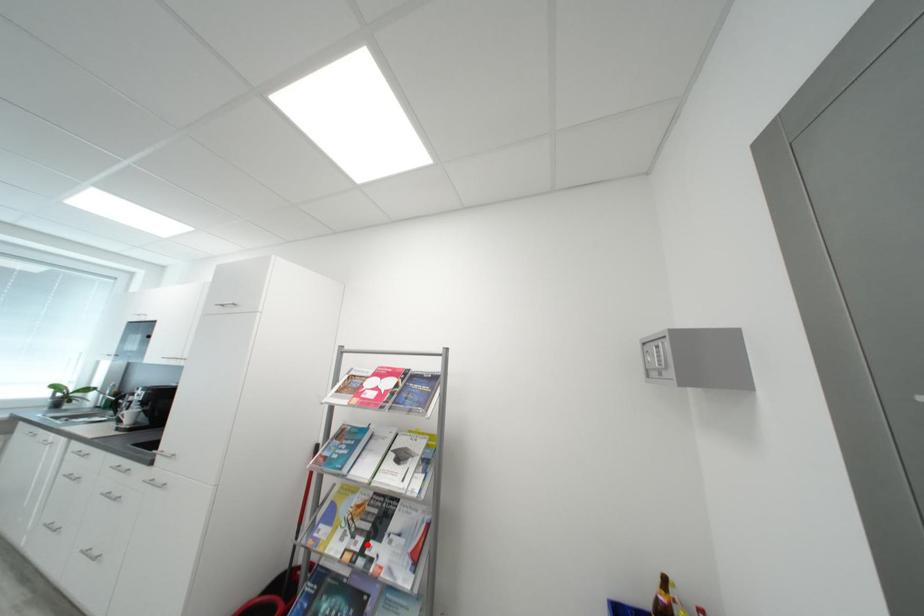
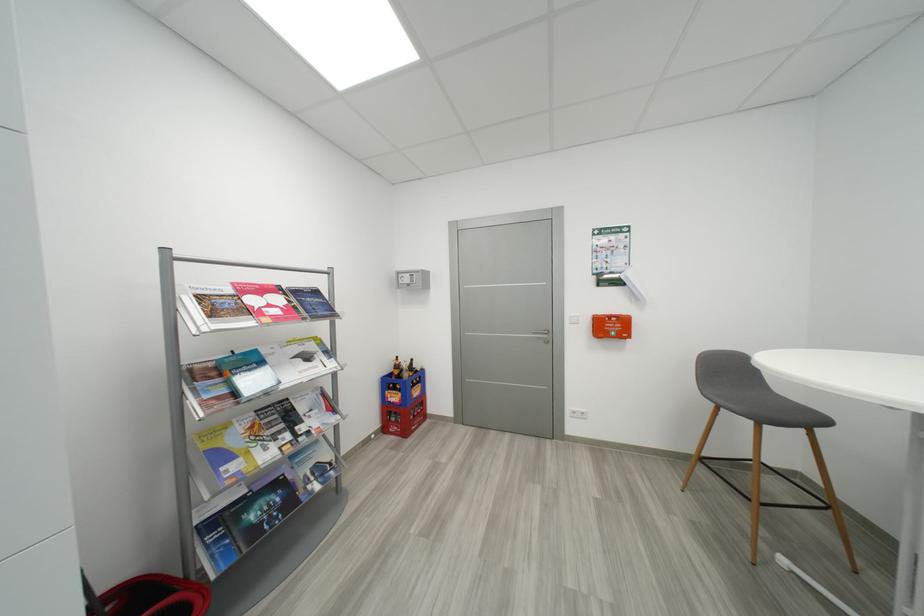
Locate, in the second image, the point that corresponds to the highlighted location in the first image.

(294, 438)